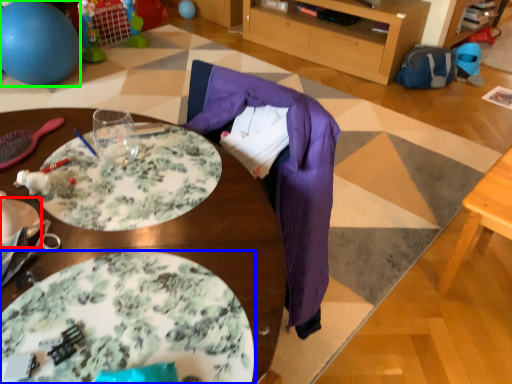
Question: Estimate the real-world distances between objects in this image. Which object is closer to plate (highlighted by a red box), plate (highlighted by a blue box) or ball (highlighted by a green box)?

Choices:
 (A) plate
 (B) ball

Answer: (A)